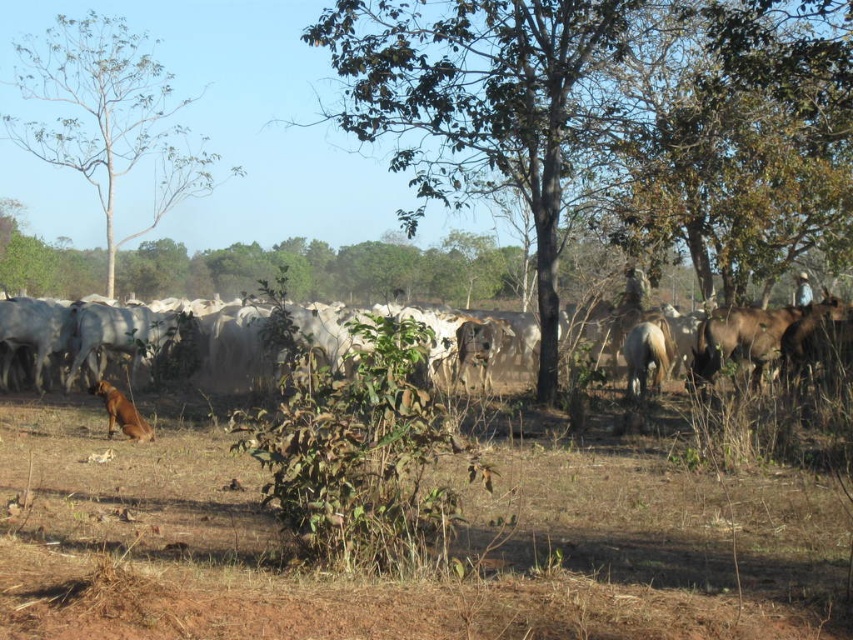
Does brown dry soil at lower center have a lesser width compared to brown fur dog at lower left?

No.

Between point (711, 561) and point (111, 397), which one is positioned in front?

Positioned in front is point (711, 561).

What do you see at coordinates (404, 579) in the screenshot?
I see `brown dry soil at lower center` at bounding box center [404, 579].

Where is `brown dry soil at lower center`? This screenshot has height=640, width=853. brown dry soil at lower center is located at coordinates (404, 579).

Can you confirm if green leafy tree at center is positioned below white matte cows at left?

No, green leafy tree at center is not below white matte cows at left.

Which is in front, point (491, 164) or point (666, 362)?

Point (666, 362)

This screenshot has width=853, height=640. What do you see at coordinates (474, 100) in the screenshot? I see `green leafy tree at center` at bounding box center [474, 100].

Locate an element on the screen. This screenshot has width=853, height=640. green leafy tree at center is located at coordinates (474, 100).

Is point (532, 456) in front of point (544, 225)?

Yes, point (532, 456) is closer to viewer.

Looking at this image, who is more distant from viewer, (636, 634) or (317, 38)?

The point (317, 38) is more distant.

Does point (822, 604) come closer to viewer compared to point (500, 60)?

Yes, point (822, 604) is closer to viewer.

The image size is (853, 640). What are the coordinates of `brown dry soil at lower center` in the screenshot? It's located at (404, 579).